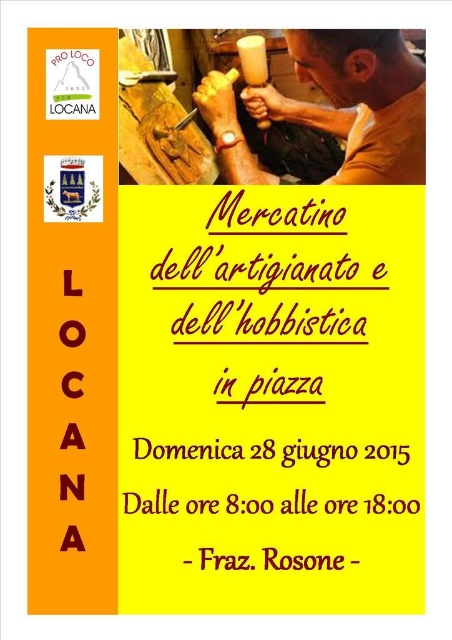
Between matte brown wood at upper center and matte yellow cup at upper center, which one is positioned higher?

matte yellow cup at upper center is above.

Is matte brown wood at upper center smaller than matte yellow cup at upper center?

Actually, matte brown wood at upper center might be larger than matte yellow cup at upper center.

What do you see at coordinates (357, 100) in the screenshot?
I see `matte brown wood at upper center` at bounding box center [357, 100].

This screenshot has height=640, width=452. I want to click on matte brown wood at upper center, so click(357, 100).